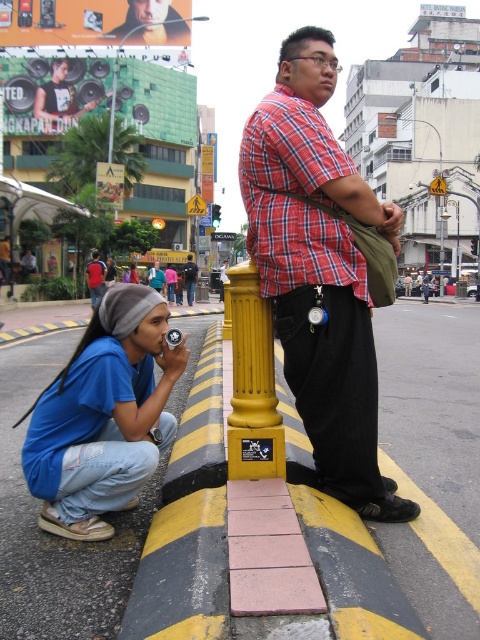
Question: Is smooth skin face at upper left bigger than blue denim jacket at lower left?

Choices:
 (A) yes
 (B) no

Answer: (B)

Question: Does blue denim jeans at lower left appear under metallic yellow pole at upper center?

Choices:
 (A) yes
 (B) no

Answer: (A)

Question: Among these points, which one is farthest from the camera?

Choices:
 (A) (418, 120)
 (B) (149, 273)
 (C) (288, 236)

Answer: (A)

Question: Does blue denim jeans at lower left come in front of red shirt at center?

Choices:
 (A) yes
 (B) no

Answer: (A)

Question: Which of these objects is positioned closest to the pink fabric shirt at center?

Choices:
 (A) smooth skin face at upper left
 (B) matte red shirt at center
 (C) yellow/black striped curb at lower left

Answer: (B)

Question: Among these points, which one is farthest from the camera?

Choices:
 (A) (133, 308)
 (B) (331, 362)
 (C) (173, 269)

Answer: (C)